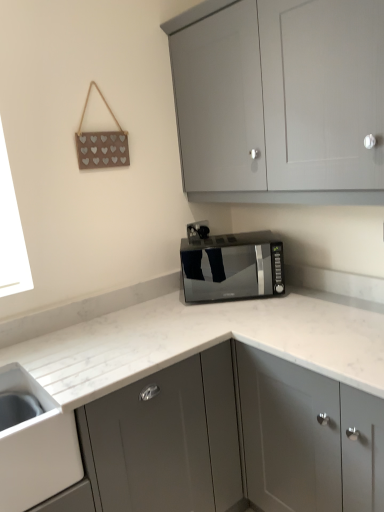
Question: Considering the relative sizes of satin black microwave at center and matte gray cabinet at upper center, which ranks as the first cabinetry in top-to-bottom order, in the image provided, is satin black microwave at center taller than matte gray cabinet at upper center, which ranks as the first cabinetry in top-to-bottom order,?

Choices:
 (A) no
 (B) yes

Answer: (A)

Question: From a real-world perspective, is satin black microwave at center physically below matte gray cabinet at upper center, the second cabinetry when ordered from bottom to top?

Choices:
 (A) yes
 (B) no

Answer: (A)

Question: From a real-world perspective, is satin black microwave at center physically above matte gray cabinet at upper center, which ranks as the first cabinetry in top-to-bottom order?

Choices:
 (A) no
 (B) yes

Answer: (A)

Question: Could you tell me if satin black microwave at center is turned towards matte gray cabinet at upper center, which ranks as the first cabinetry in top-to-bottom order?

Choices:
 (A) no
 (B) yes

Answer: (A)

Question: From the image's perspective, is satin black microwave at center over matte gray cabinet at upper center, which ranks as the first cabinetry in top-to-bottom order?

Choices:
 (A) yes
 (B) no

Answer: (B)

Question: Based on their positions, is white glossy sink at lower left located to the left or right of satin grey cabinet at center, arranged as the 1th cabinetry when ordered from the bottom?

Choices:
 (A) left
 (B) right

Answer: (A)

Question: Considering the positions of white glossy sink at lower left and satin grey cabinet at center, arranged as the 1th cabinetry when ordered from the bottom, in the image, is white glossy sink at lower left wider or thinner than satin grey cabinet at center, arranged as the 1th cabinetry when ordered from the bottom,?

Choices:
 (A) thin
 (B) wide

Answer: (A)

Question: Is white glossy sink at lower left situated inside satin grey cabinet at center, arranged as the 1th cabinetry when ordered from the bottom, or outside?

Choices:
 (A) inside
 (B) outside

Answer: (B)

Question: From their relative heights in the image, would you say white glossy sink at lower left is taller or shorter than satin grey cabinet at center, arranged as the 1th cabinetry when ordered from the bottom?

Choices:
 (A) short
 (B) tall

Answer: (A)

Question: Based on their sizes in the image, would you say satin grey cabinet at center, which ranks as the second cabinetry in top-to-bottom order, is bigger or smaller than satin black microwave at center?

Choices:
 (A) big
 (B) small

Answer: (A)

Question: In terms of height, does satin grey cabinet at center, arranged as the 1th cabinetry when ordered from the bottom, look taller or shorter compared to satin black microwave at center?

Choices:
 (A) tall
 (B) short

Answer: (A)

Question: From the image's perspective, is satin grey cabinet at center, which ranks as the second cabinetry in top-to-bottom order, positioned above or below satin black microwave at center?

Choices:
 (A) below
 (B) above

Answer: (A)

Question: From a real-world perspective, is satin grey cabinet at center, arranged as the 1th cabinetry when ordered from the bottom, physically located above or below satin black microwave at center?

Choices:
 (A) below
 (B) above

Answer: (A)

Question: Does point click(258, 165) appear closer or farther from the camera than point click(190, 236)?

Choices:
 (A) farther
 (B) closer

Answer: (B)

Question: Is matte gray cabinet at upper center, which ranks as the first cabinetry in top-to-bottom order, taller or shorter than black plastic electric outlet at center?

Choices:
 (A) tall
 (B) short

Answer: (A)